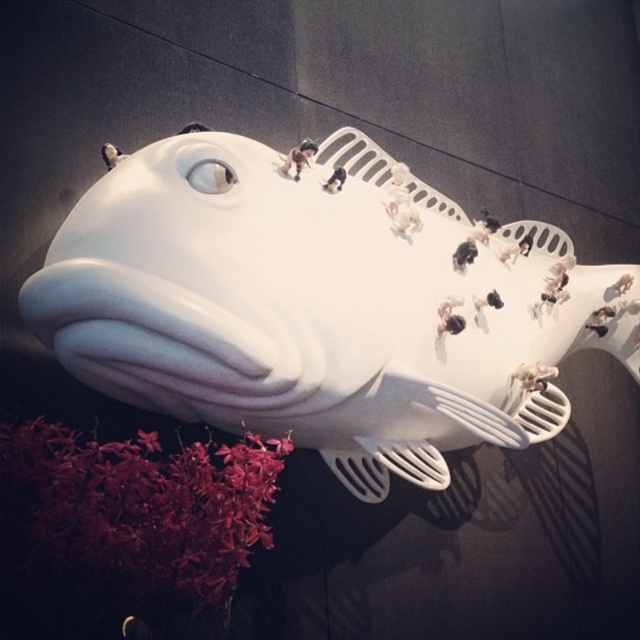
You are an art curator planning to display the white glossy fish at center and the velvety crimson blooms at bottom left in a new exhibition. If you want to place them side by side, which object should be positioned first to emphasize their size difference?

The white glossy fish at center should be positioned first because its width is larger than the velvety crimson blooms at bottom left, so placing the larger object first will effectively highlight the size contrast between them.

You are an art curator planning to move the velvety crimson blooms at bottom left closer to the white glossy fish at center. Based on their current positions, which direction should you move the flowers to place them directly next to the fish?

To place the velvety crimson blooms at bottom left directly next to the white glossy fish at center, you should move them to the right since the white glossy fish at center is currently positioned to the right of the flowers.